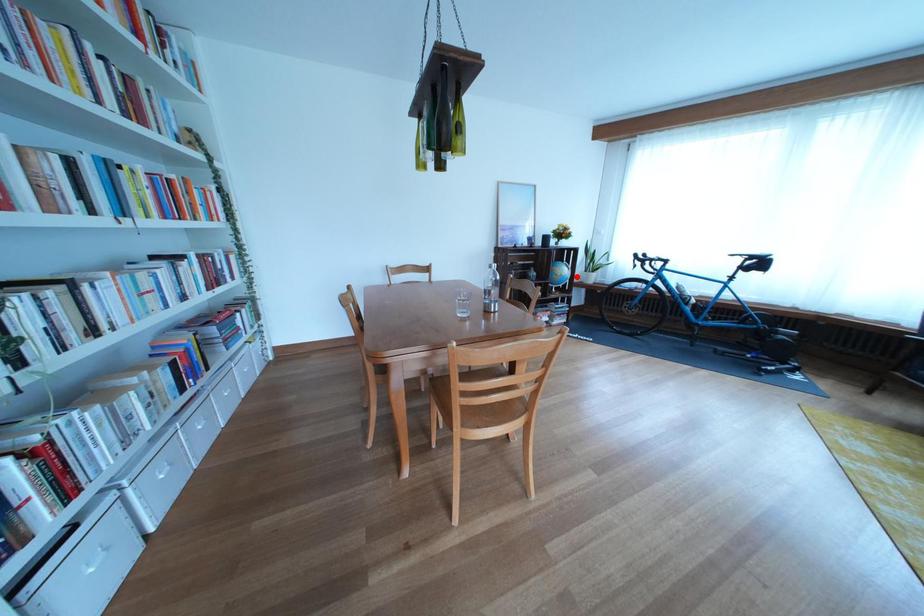
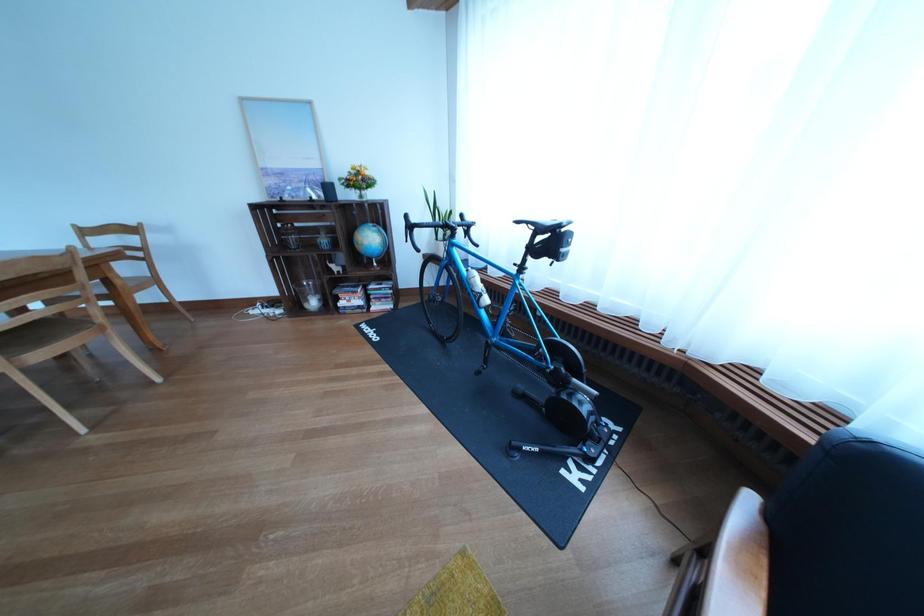
The point at the highlighted location is marked in the first image. Where is the corresponding point in the second image?

(383, 244)